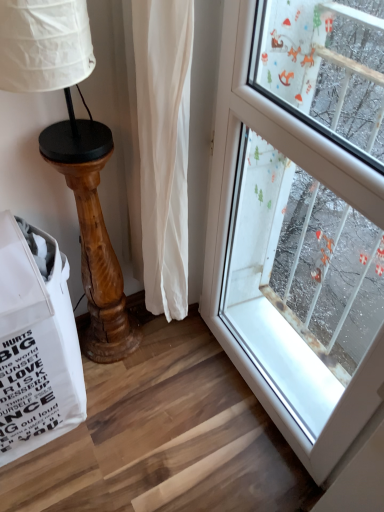
Question: Can you confirm if wooden table lamp at left is bigger than white fabric grocery bag at lower left?

Choices:
 (A) yes
 (B) no

Answer: (B)

Question: Could you tell me if wooden table lamp at left is turned towards white fabric grocery bag at lower left?

Choices:
 (A) yes
 (B) no

Answer: (B)

Question: From a real-world perspective, is wooden table lamp at left physically above white fabric grocery bag at lower left?

Choices:
 (A) yes
 (B) no

Answer: (A)

Question: Can you confirm if wooden table lamp at left is taller than white fabric grocery bag at lower left?

Choices:
 (A) yes
 (B) no

Answer: (A)

Question: Are wooden table lamp at left and white fabric grocery bag at lower left located far from each other?

Choices:
 (A) no
 (B) yes

Answer: (A)

Question: Considering the relative sizes of wooden table lamp at left and white fabric grocery bag at lower left in the image provided, is wooden table lamp at left thinner than white fabric grocery bag at lower left?

Choices:
 (A) yes
 (B) no

Answer: (A)

Question: Could you tell me if white fabric grocery bag at lower left is facing wooden table lamp at left?

Choices:
 (A) yes
 (B) no

Answer: (B)

Question: Is white fabric grocery bag at lower left smaller than wooden table lamp at left?

Choices:
 (A) yes
 (B) no

Answer: (B)

Question: Is white fabric grocery bag at lower left thinner than wooden table lamp at left?

Choices:
 (A) no
 (B) yes

Answer: (A)

Question: Is white fabric grocery bag at lower left to the left of wooden table lamp at left from the viewer's perspective?

Choices:
 (A) no
 (B) yes

Answer: (B)

Question: From a real-world perspective, is white fabric grocery bag at lower left beneath wooden table lamp at left?

Choices:
 (A) no
 (B) yes

Answer: (B)

Question: Is white fabric grocery bag at lower left bigger than wooden table lamp at left?

Choices:
 (A) no
 (B) yes

Answer: (B)

Question: In terms of size, does white fabric grocery bag at lower left appear bigger or smaller than wooden table lamp at left?

Choices:
 (A) small
 (B) big

Answer: (B)